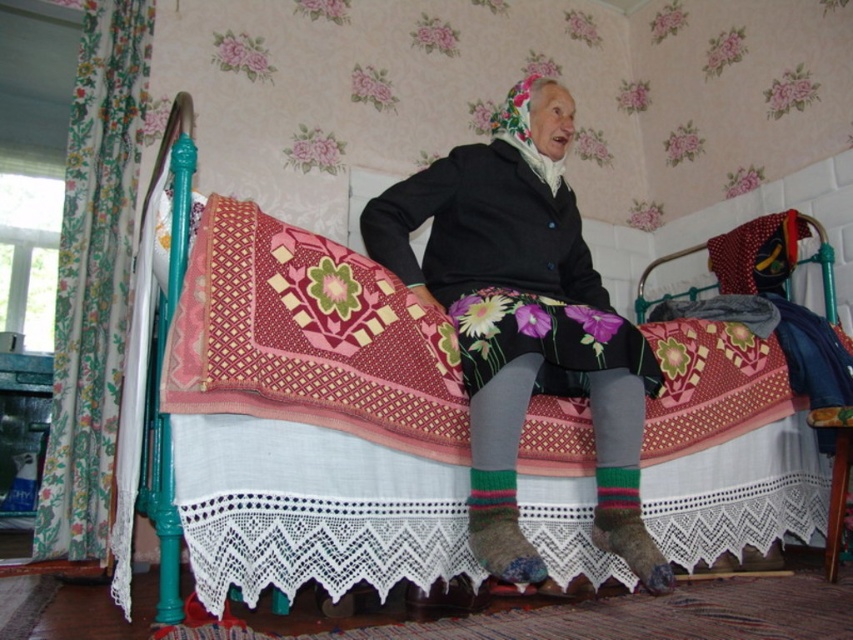
Which is more to the right, pink fabric bed at center or floral-patterned fabric skirt at center?

From the viewer's perspective, pink fabric bed at center appears more on the right side.

Is pink fabric bed at center bigger than floral-patterned fabric skirt at center?

Correct, pink fabric bed at center is larger in size than floral-patterned fabric skirt at center.

Describe the element at coordinates (317, 461) in the screenshot. I see `pink fabric bed at center` at that location.

Locate an element on the screen. The image size is (853, 640). pink fabric bed at center is located at coordinates click(x=317, y=461).